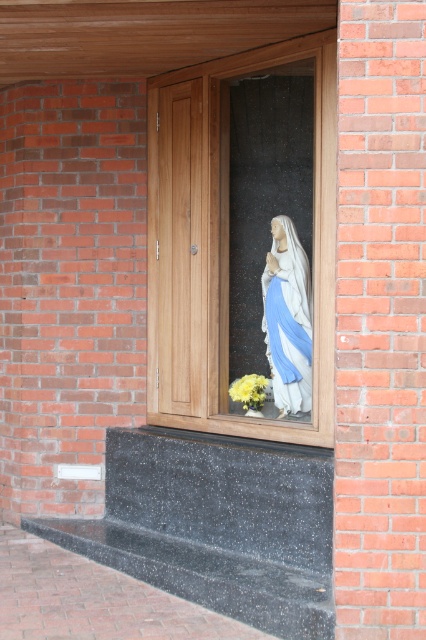
Is point (207, 268) in front of point (249, 388)?

No, (207, 268) is behind (249, 388).

Measure the distance between transparent glass statue at center and yellow matte flower at center.

A distance of 30.81 inches exists between transparent glass statue at center and yellow matte flower at center.

This screenshot has height=640, width=426. What do you see at coordinates (244, 241) in the screenshot? I see `transparent glass statue at center` at bounding box center [244, 241].

Locate an element on the screen. The height and width of the screenshot is (640, 426). transparent glass statue at center is located at coordinates coord(244,241).

Who is more distant from viewer, (291, 310) or (278, 236)?

Positioned behind is point (278, 236).

Does point (232, 294) lie in front of point (310, 292)?

No, (232, 294) is further to viewer.

I want to click on transparent glass statue at center, so click(244, 241).

Does point (310, 296) come in front of point (239, 394)?

That is True.

Which is more to the right, white marble statue at center or yellow matte flower at center?

Positioned to the right is white marble statue at center.

Is point (276, 310) positioned in front of point (236, 378)?

Yes, point (276, 310) is closer to viewer.

Locate an element on the screen. This screenshot has width=426, height=640. white marble statue at center is located at coordinates (287, 317).